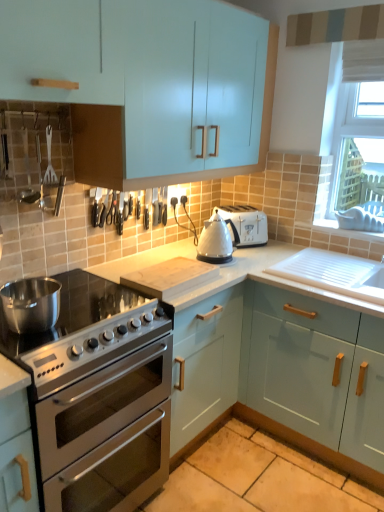
Question: Is wooden cutting board at center, placed as the second appliance when sorted from top to bottom, facing away from satin silver gas stove at lower left?

Choices:
 (A) no
 (B) yes

Answer: (A)

Question: From a real-world perspective, is wooden cutting board at center, marked as the 1th appliance in a bottom-to-top arrangement, on top of satin silver gas stove at lower left?

Choices:
 (A) yes
 (B) no

Answer: (A)

Question: Is wooden cutting board at center, marked as the 1th appliance in a bottom-to-top arrangement, surrounding satin silver gas stove at lower left?

Choices:
 (A) no
 (B) yes

Answer: (A)

Question: Does wooden cutting board at center, placed as the second appliance when sorted from top to bottom, come in front of satin silver gas stove at lower left?

Choices:
 (A) yes
 (B) no

Answer: (B)

Question: Does wooden cutting board at center, placed as the second appliance when sorted from top to bottom, turn towards satin silver gas stove at lower left?

Choices:
 (A) no
 (B) yes

Answer: (A)

Question: From the image's perspective, is wooden cutting board at center, marked as the 1th appliance in a bottom-to-top arrangement, on top of satin silver gas stove at lower left?

Choices:
 (A) no
 (B) yes

Answer: (B)

Question: Considering the relative sizes of white glossy kettle at center, which is counted as the 1th appliance, starting from the top, and brushed metal spatula at upper left in the image provided, is white glossy kettle at center, which is counted as the 1th appliance, starting from the top, bigger than brushed metal spatula at upper left?

Choices:
 (A) no
 (B) yes

Answer: (B)

Question: Can you confirm if white glossy kettle at center, the second appliance ordered from the bottom, is smaller than brushed metal spatula at upper left?

Choices:
 (A) yes
 (B) no

Answer: (B)

Question: Is white glossy kettle at center, which is counted as the 1th appliance, starting from the top, at the right side of brushed metal spatula at upper left?

Choices:
 (A) no
 (B) yes

Answer: (B)

Question: Considering the relative sizes of white glossy kettle at center, which is counted as the 1th appliance, starting from the top, and brushed metal spatula at upper left in the image provided, is white glossy kettle at center, which is counted as the 1th appliance, starting from the top, shorter than brushed metal spatula at upper left?

Choices:
 (A) yes
 (B) no

Answer: (A)

Question: From the image's perspective, is white glossy kettle at center, the second appliance ordered from the bottom, located above brushed metal spatula at upper left?

Choices:
 (A) no
 (B) yes

Answer: (A)

Question: From the image's perspective, would you say white glossy kettle at center, which is counted as the 1th appliance, starting from the top, is shown under brushed metal spatula at upper left?

Choices:
 (A) no
 (B) yes

Answer: (B)

Question: From a real-world perspective, is matte light blue cabinet at center, the second cabinetry ordered from the bottom, located higher than wooden cutting board at center, marked as the 1th appliance in a bottom-to-top arrangement?

Choices:
 (A) no
 (B) yes

Answer: (A)